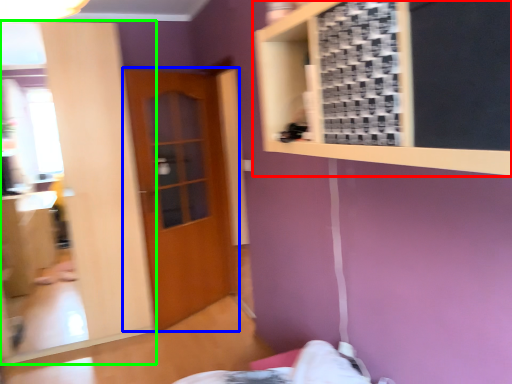
Question: Which object is positioned closest to bulletin board (highlighted by a red box)? Select from door (highlighted by a blue box) and mirror (highlighted by a green box).

Choices:
 (A) door
 (B) mirror

Answer: (B)